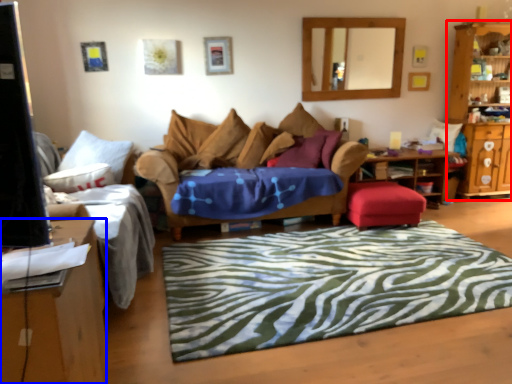
Question: Among these objects, which one is nearest to the camera, cabinetry (highlighted by a red box) or desk (highlighted by a blue box)?

Choices:
 (A) cabinetry
 (B) desk

Answer: (B)